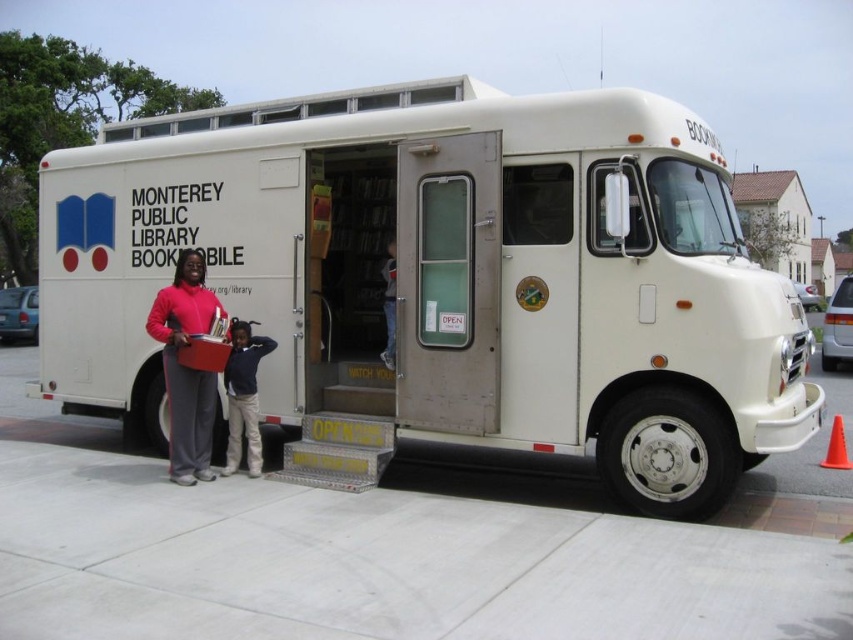
Question: Considering the relative positions of white matte bookmobile at center and matte pink sweater at center in the image provided, where is white matte bookmobile at center located with respect to matte pink sweater at center?

Choices:
 (A) below
 (B) above

Answer: (A)

Question: Which of the following is the closest to the observer?

Choices:
 (A) (x=323, y=358)
 (B) (x=238, y=344)
 (C) (x=213, y=387)

Answer: (C)

Question: Which of the following is the farthest from the observer?

Choices:
 (A) (672, 444)
 (B) (228, 403)

Answer: (B)

Question: Which point is farther from the camera taking this photo?

Choices:
 (A) (196, 432)
 (B) (647, 188)
 (C) (231, 362)

Answer: (C)

Question: Observing the image, what is the correct spatial positioning of white matte bookmobile at center in reference to dark blue sweater at center?

Choices:
 (A) left
 (B) right

Answer: (B)

Question: Is white matte bookmobile at center to the right of dark blue sweater at center from the viewer's perspective?

Choices:
 (A) no
 (B) yes

Answer: (B)